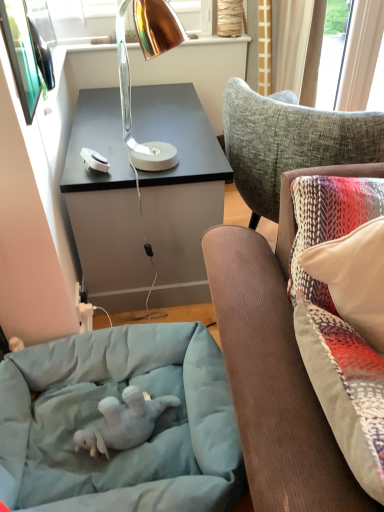
Question: Is copper metallic desk lamp at upper center to the right of soft gray plush baby elephant at lower left from the viewer's perspective?

Choices:
 (A) yes
 (B) no

Answer: (A)

Question: Considering the relative sizes of copper metallic desk lamp at upper center and soft gray plush baby elephant at lower left in the image provided, is copper metallic desk lamp at upper center wider than soft gray plush baby elephant at lower left?

Choices:
 (A) no
 (B) yes

Answer: (B)

Question: Is copper metallic desk lamp at upper center not near soft gray plush baby elephant at lower left?

Choices:
 (A) yes
 (B) no

Answer: (A)

Question: Is copper metallic desk lamp at upper center facing away from soft gray plush baby elephant at lower left?

Choices:
 (A) no
 (B) yes

Answer: (A)

Question: Can you confirm if copper metallic desk lamp at upper center is bigger than soft gray plush baby elephant at lower left?

Choices:
 (A) yes
 (B) no

Answer: (A)

Question: Is suede couch cushion at right situated inside soft gray plush baby elephant at lower left or outside?

Choices:
 (A) outside
 (B) inside

Answer: (A)

Question: Would you say suede couch cushion at right is to the left or to the right of soft gray plush baby elephant at lower left in the picture?

Choices:
 (A) right
 (B) left

Answer: (A)

Question: Considering the positions of suede couch cushion at right and soft gray plush baby elephant at lower left in the image, is suede couch cushion at right wider or thinner than soft gray plush baby elephant at lower left?

Choices:
 (A) thin
 (B) wide

Answer: (B)

Question: From a real-world perspective, is suede couch cushion at right positioned above or below soft gray plush baby elephant at lower left?

Choices:
 (A) above
 (B) below

Answer: (A)

Question: Is suede couch cushion at right wider or thinner than copper metallic desk lamp at upper center?

Choices:
 (A) thin
 (B) wide

Answer: (B)

Question: Looking at the image, does suede couch cushion at right seem bigger or smaller compared to copper metallic desk lamp at upper center?

Choices:
 (A) big
 (B) small

Answer: (A)

Question: Which is correct: suede couch cushion at right is inside copper metallic desk lamp at upper center, or outside of it?

Choices:
 (A) inside
 (B) outside

Answer: (B)

Question: In terms of height, does suede couch cushion at right look taller or shorter compared to copper metallic desk lamp at upper center?

Choices:
 (A) short
 (B) tall

Answer: (B)

Question: Is point (162, 426) closer or farther from the camera than point (120, 109)?

Choices:
 (A) closer
 (B) farther

Answer: (A)

Question: Is light blue fabric dog bed at lower left spatially inside copper metallic desk lamp at upper center, or outside of it?

Choices:
 (A) inside
 (B) outside

Answer: (B)